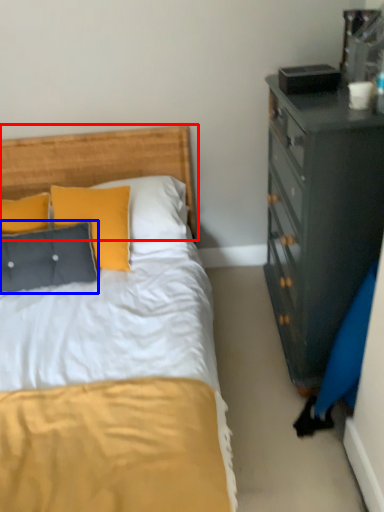
Question: Which point is closer to the camera, headboard (highlighted by a red box) or pillow (highlighted by a blue box)?

Choices:
 (A) headboard
 (B) pillow

Answer: (B)